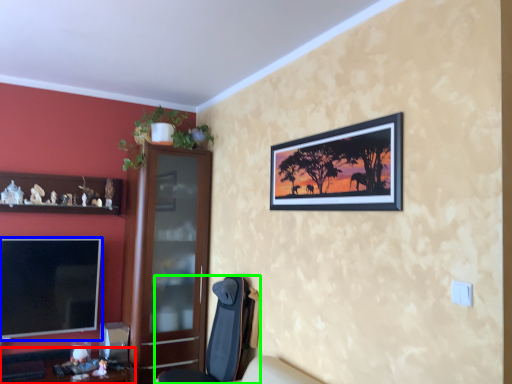
Question: Which object is the closest to the desk (highlighted by a red box)? Choose among these: television (highlighted by a blue box) or chair (highlighted by a green box).

Choices:
 (A) television
 (B) chair

Answer: (A)